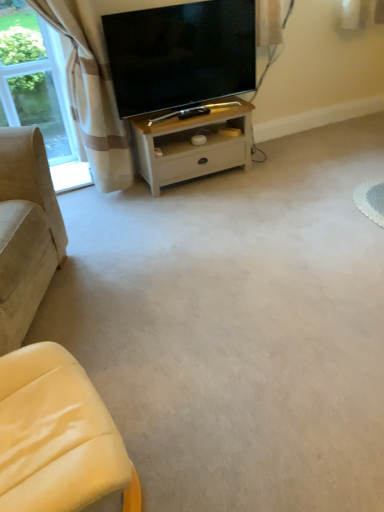
What are the coordinates of `free space in front of beige plaid curtain at upper left` in the screenshot? It's located at (100, 225).